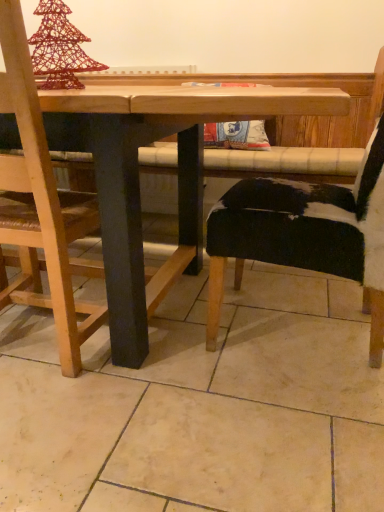
Locate an element on the screen. free area in between black cowhide chair at right, which is counted as the first chair, starting from the right, and wooden table at center is located at coordinates (330, 377).